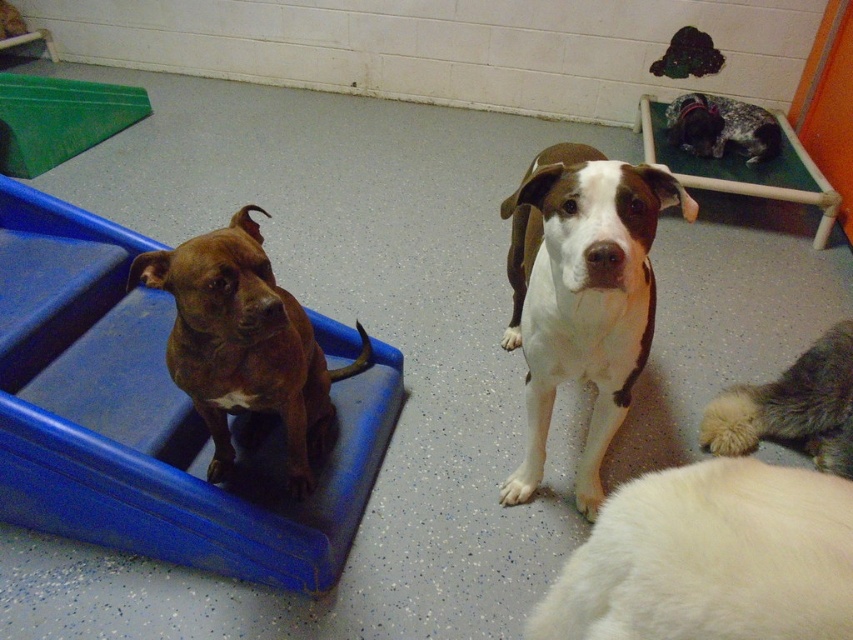
You are a dog owner who wants to buy a bed for your new dog. The dog you have is the same size as the white smooth dog at center. The bed you are considering is the spotted fur bed at upper right. Based on the image, will the bed be big enough for your dog to lie comfortably?

The white smooth dog at center is much taller than the spotted fur bed at upper right, so the bed may not be large enough for the dog to lie comfortably.

You are a dog trainer who needs to place a 24 inch wide feeding tray between the white smooth dog at center and the brown glossy dog at left. Can the feeding tray fit between them?

The distance between the white smooth dog at center and the brown glossy dog at left is 20.50 inches. Since the feeding tray is 24 inches wide, it cannot fit between them as the distance is shorter than the required space.